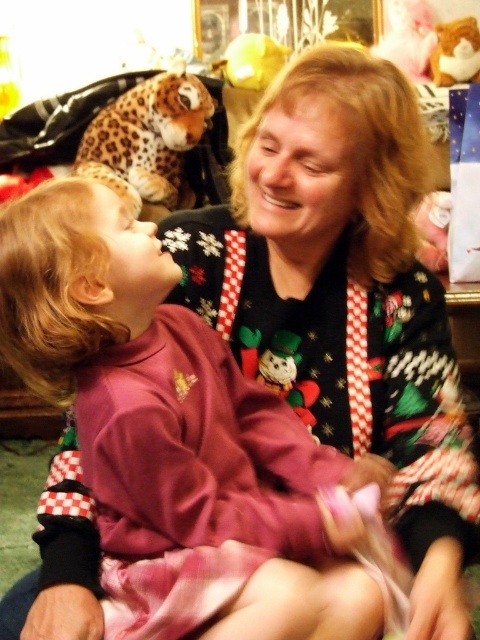
Question: From the image, what is the correct spatial relationship of plush snowman at center in relation to fluffy plush bear at upper right?

Choices:
 (A) above
 (B) below

Answer: (B)

Question: Among these objects, which one is nearest to the camera?

Choices:
 (A) purple fleece pajamas at center
 (B) fluffy plush bear at upper right
 (C) leopard-patterned plush toy at upper left

Answer: (A)

Question: Which point is farther to the camera?

Choices:
 (A) fluffy plush bear at upper right
 (B) purple fleece pajamas at center
 (C) plush snowman at center
 (D) leopard-patterned plush toy at upper left

Answer: (A)

Question: Does purple fleece pajamas at center appear on the left side of leopard-patterned plush toy at upper left?

Choices:
 (A) no
 (B) yes

Answer: (A)

Question: Among these objects, which one is nearest to the camera?

Choices:
 (A) plush snowman at center
 (B) fluffy plush bear at upper right
 (C) leopard-patterned plush toy at upper left

Answer: (A)

Question: Is purple fleece pajamas at center behind leopard-patterned plush toy at upper left?

Choices:
 (A) yes
 (B) no

Answer: (B)